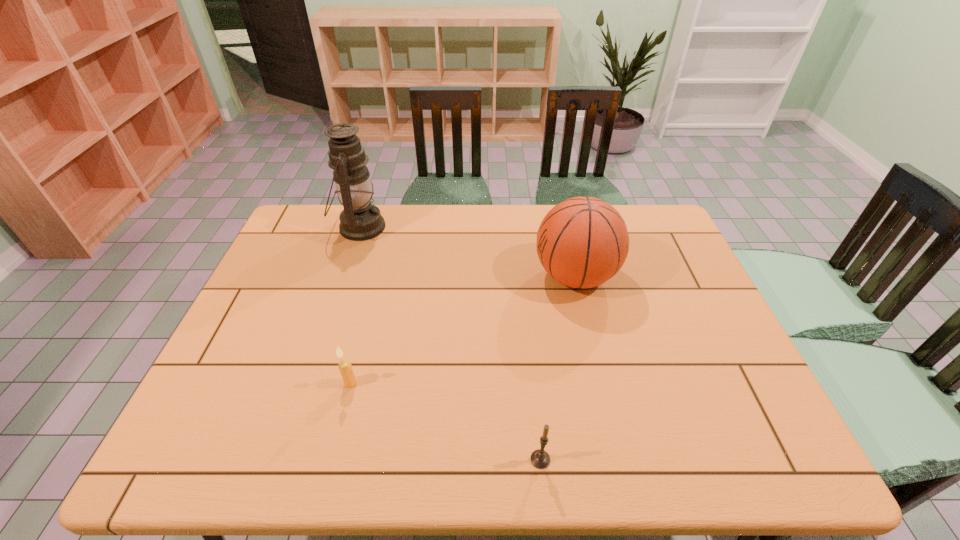
Locate an element on the screen. This screenshot has width=960, height=540. vacant space situated 0.070m on the right of the left candle is located at coordinates (386, 383).

In order to click on free space located on the left of the second object from right to left in this screenshot , I will do `click(420, 459)`.

This screenshot has height=540, width=960. Identify the location of object that is at the far edge. (360, 220).

Identify the location of object present at the near edge. This screenshot has height=540, width=960. (540, 458).

Where is `object at the left edge`? This screenshot has height=540, width=960. object at the left edge is located at coordinates (360, 220).

Find the location of a particular element. object at the far left corner is located at coordinates (360, 220).

The image size is (960, 540). I want to click on vacant space at the far edge, so click(522, 209).

Locate an element on the screen. vacant space at the near edge of the desktop is located at coordinates (340, 449).

At what (x,y) coordinates should I click in order to perform the action: click on free point at the left edge. Please return your answer as a coordinate pair (x, y). Looking at the image, I should click on (273, 333).

Find the location of a particular element. The image size is (960, 540). vacant space at the right edge of the desktop is located at coordinates (660, 281).